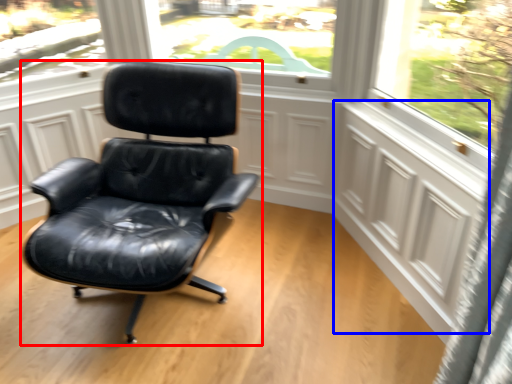
Question: Which object is further to the camera taking this photo, chair (highlighted by a red box) or screen door (highlighted by a blue box)?

Choices:
 (A) chair
 (B) screen door

Answer: (B)